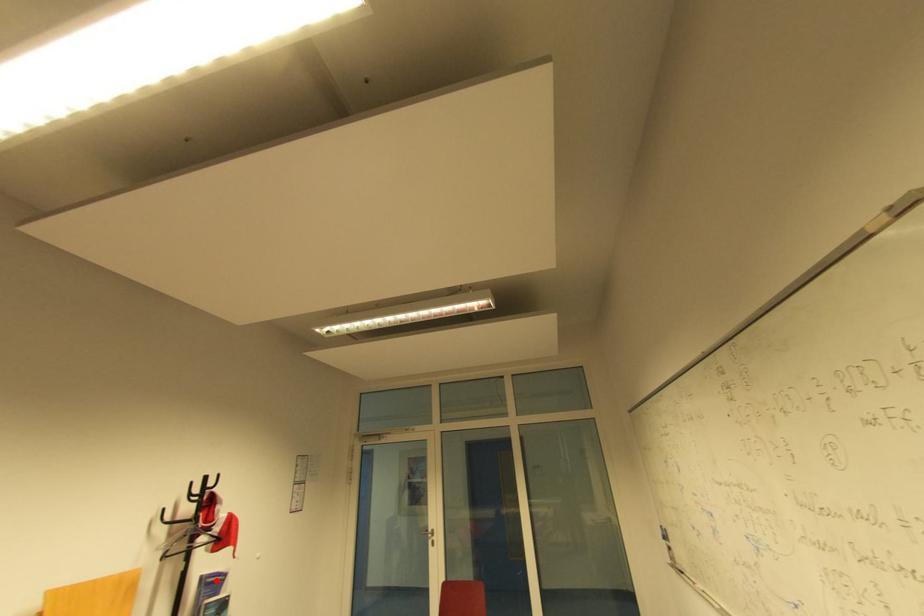
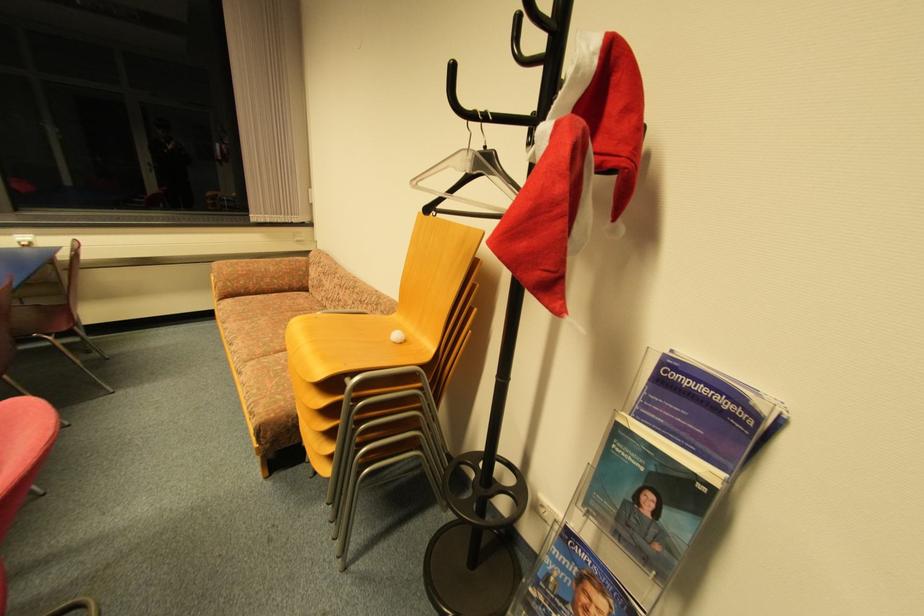
Question: A red point is marked in image1. In image2, is the corresponding 3D point closer to the camera or farther? Reply with the corresponding letter.

Choices:
 (A) The corresponding 3D point is closer.
 (B) The corresponding 3D point is farther.

Answer: (B)